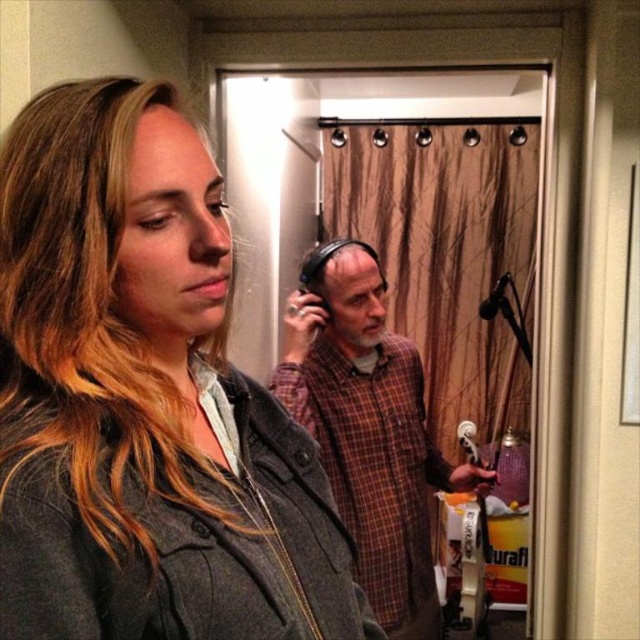
You are standing in the recording studio and want to reach the point at coordinates point (122, 420). If your arm can reach 50 centimeters, can you touch that point without moving your feet?

The point (122, 420) is 49.56 centimeters from the viewer, so yes, you can touch it with your arm since it is within reach.

You are designing a storage system for clothing items. You have two garments in front of you, the matte gray jacket at center and the plaid fabric shirt at center. Based on their sizes, which garment should you allocate more space for in the storage system?

The plaid fabric shirt at center requires more storage space because the matte gray jacket at center is narrower than the plaid fabric shirt at center.

You are a photographer standing in front of the matte gray jacket at center. You want to take a closeup shot of the jacket without moving the camera. Is the jacket within your camera lens range if the minimum focusing distance is 16 inches?

The distance between the matte gray jacket at center and the camera is 16.66 inches. Since the minimum focusing distance is 16 inches, the camera can focus on the matte gray jacket at center as it is within range.